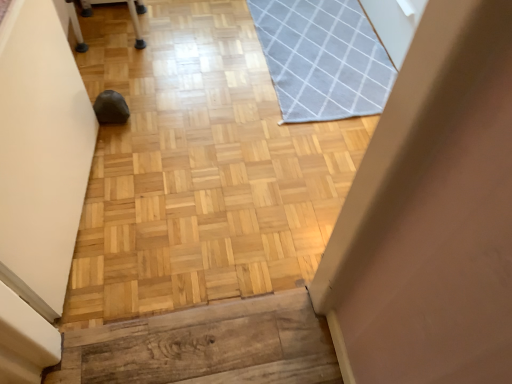
Image resolution: width=512 pixels, height=384 pixels. I want to click on free location in front of gray woven mat at upper right, so click(x=260, y=168).